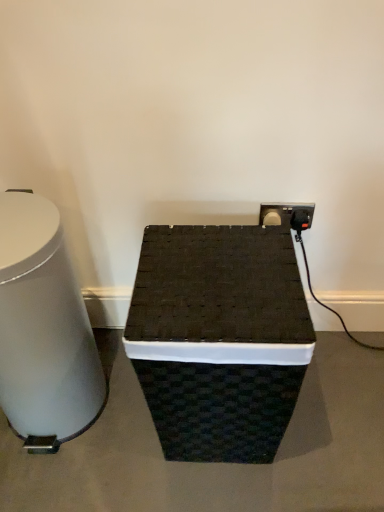
Question: Should I look upward or downward to see white glossy trash can at left?

Choices:
 (A) up
 (B) down

Answer: (B)

Question: From a real-world perspective, is white glossy trash can at left positioned over black woven basket at center based on gravity?

Choices:
 (A) yes
 (B) no

Answer: (A)

Question: Is white glossy trash can at left positioned beyond the bounds of black woven basket at center?

Choices:
 (A) no
 (B) yes

Answer: (B)

Question: From the image's perspective, is white glossy trash can at left located above black woven basket at center?

Choices:
 (A) no
 (B) yes

Answer: (B)

Question: Is white glossy trash can at left looking in the opposite direction of black woven basket at center?

Choices:
 (A) yes
 (B) no

Answer: (B)

Question: Does white glossy trash can at left have a lesser width compared to black woven basket at center?

Choices:
 (A) yes
 (B) no

Answer: (A)

Question: Can you confirm if white glossy trash can at left is positioned to the left of black woven basket at center?

Choices:
 (A) yes
 (B) no

Answer: (A)

Question: Is black woven basket at center thinner than white glossy trash can at left?

Choices:
 (A) no
 (B) yes

Answer: (A)

Question: Considering the relative sizes of black woven basket at center and white glossy trash can at left in the image provided, is black woven basket at center smaller than white glossy trash can at left?

Choices:
 (A) yes
 (B) no

Answer: (B)

Question: Is black woven basket at center facing towards white glossy trash can at left?

Choices:
 (A) no
 (B) yes

Answer: (A)

Question: Is the surface of black woven basket at center in direct contact with white glossy trash can at left?

Choices:
 (A) yes
 (B) no

Answer: (B)

Question: Is black woven basket at center further to the viewer compared to white glossy trash can at left?

Choices:
 (A) no
 (B) yes

Answer: (B)

Question: Is black woven basket at center oriented away from white glossy trash can at left?

Choices:
 (A) no
 (B) yes

Answer: (A)

Question: Would you say black woven basket at center is inside or outside white glossy trash can at left?

Choices:
 (A) inside
 (B) outside

Answer: (B)